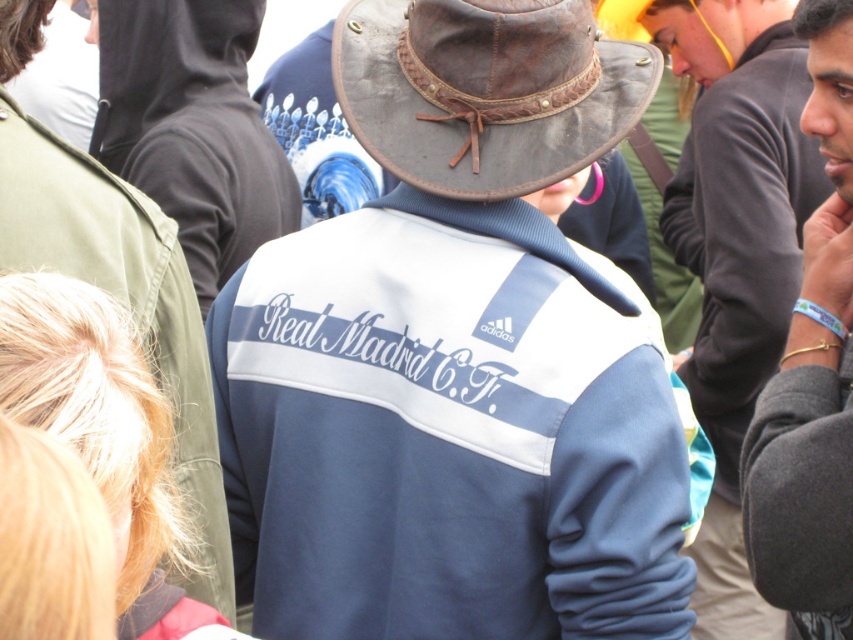
Between navy blue fleece jacket at center and brown leather fedora at center, which one has less height?

brown leather fedora at center is shorter.

What do you see at coordinates (445, 435) in the screenshot? I see `navy blue fleece jacket at center` at bounding box center [445, 435].

Is point (231, 355) positioned before point (370, 51)?

That is True.

At what (x,y) coordinates should I click in order to perform the action: click on navy blue fleece jacket at center. Please return your answer as a coordinate pair (x, y). The width and height of the screenshot is (853, 640). Looking at the image, I should click on (445, 435).

Locate an element on the screen. The width and height of the screenshot is (853, 640). brown leather fedora at center is located at coordinates (485, 90).

Which is above, brown leather fedora at center or blue fleece jacket at center?

brown leather fedora at center

I want to click on brown leather fedora at center, so click(485, 90).

Is navy blue fleece jacket at center further to camera compared to gray fleece jacket at center?

That is True.

Is point (585, 552) positioned behind point (784, 488)?

Yes, it is behind point (784, 488).

Which is behind, point (566, 296) or point (838, 120)?

The point (838, 120) is behind.

Find the location of a particular element. This screenshot has height=640, width=853. navy blue fleece jacket at center is located at coordinates (445, 435).